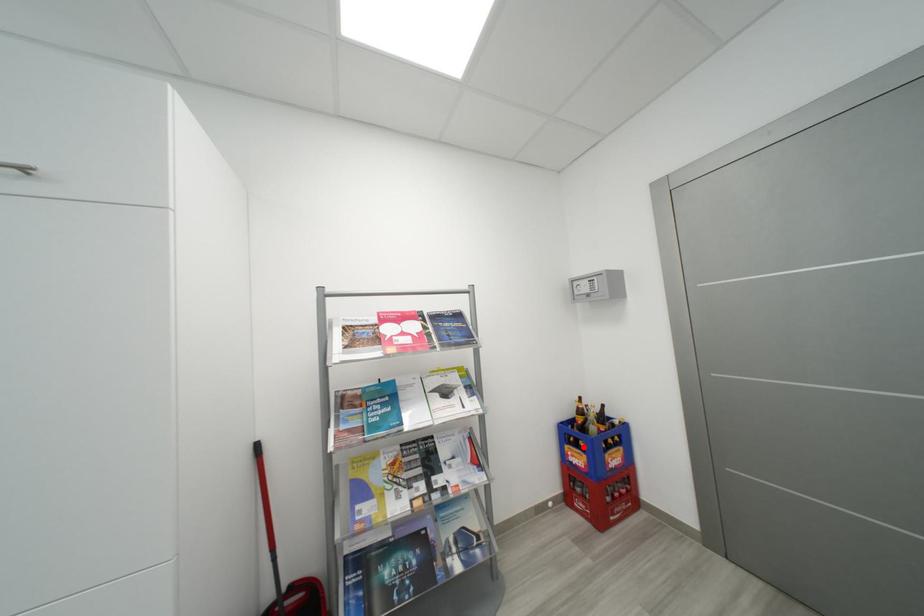
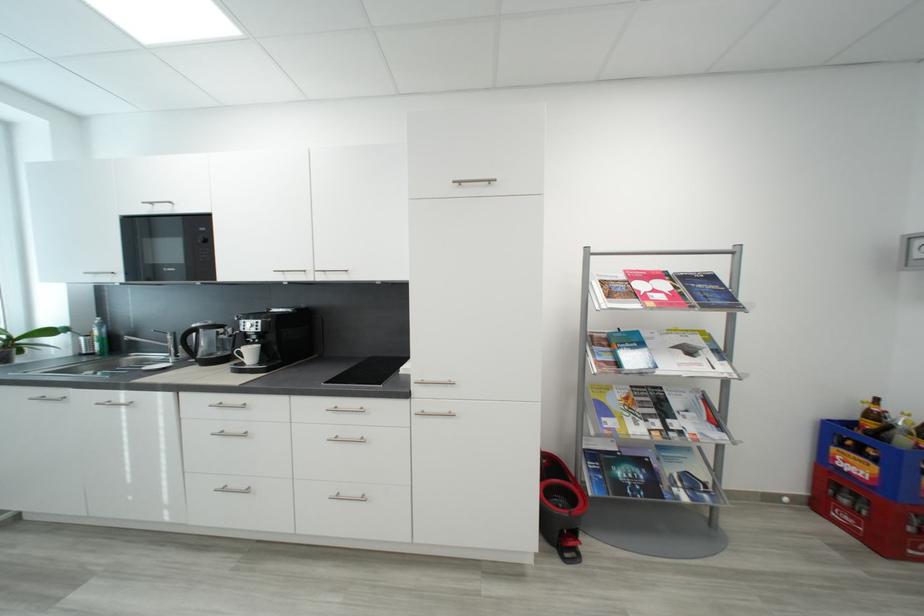
Locate, in the second image, the point that corresponds to the highlighted location in the first image.

(867, 454)